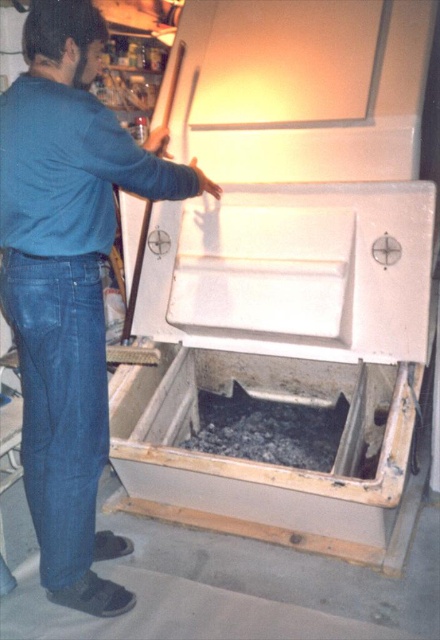
Question: Which of the following is the closest to the observer?

Choices:
 (A) (117, 136)
 (B) (278, 417)

Answer: (A)

Question: Is denim at left behind black gravel at lower center?

Choices:
 (A) no
 (B) yes

Answer: (A)

Question: Which of these objects is positioned farthest from the denim at left?

Choices:
 (A) blue denim jeans at lower left
 (B) white matte washing machine at center
 (C) black gravel at lower center

Answer: (C)

Question: Estimate the real-world distances between objects in this image. Which object is closer to the denim at left?

Choices:
 (A) blue denim jeans at lower left
 (B) white matte washing machine at center

Answer: (A)

Question: Is white matte washing machine at center below denim at left?

Choices:
 (A) no
 (B) yes

Answer: (A)

Question: Does white matte washing machine at center appear on the left side of blue denim jeans at lower left?

Choices:
 (A) no
 (B) yes

Answer: (A)